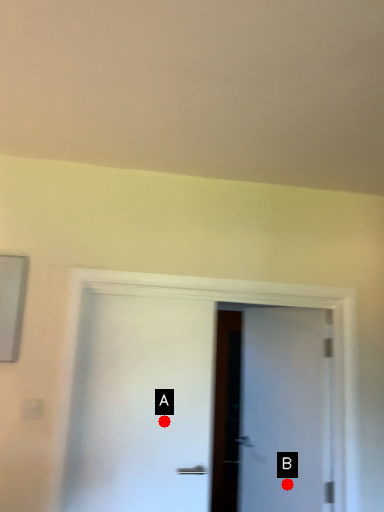
Question: Two points are circled on the image, labeled by A and B beside each circle. Which point is farther to the camera?

Choices:
 (A) A is further
 (B) B is further

Answer: (B)